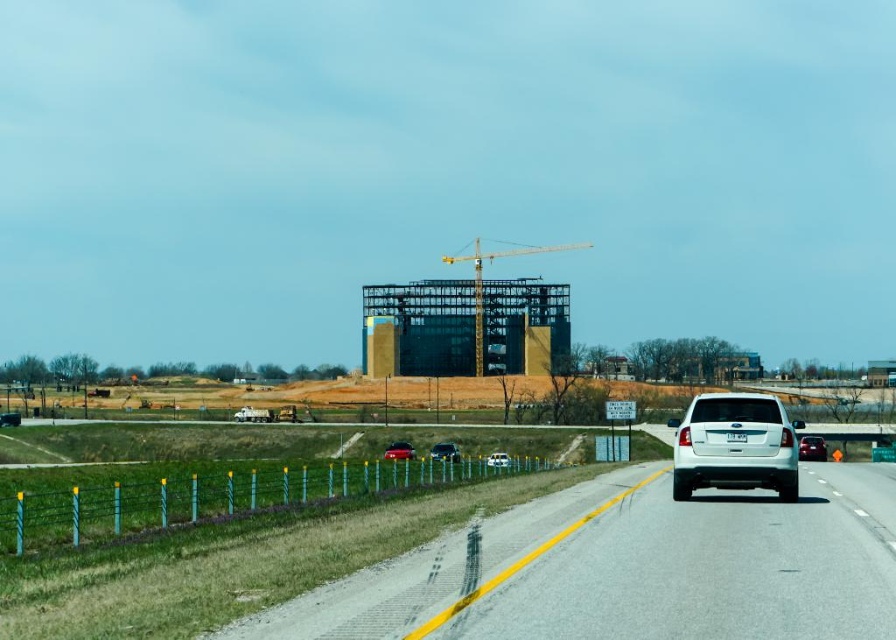
Question: Can you confirm if shiny red car at center is positioned to the right of white matte car at center?

Choices:
 (A) no
 (B) yes

Answer: (A)

Question: Can you confirm if white matte suv at center-right is positioned above shiny black sedan at center?

Choices:
 (A) yes
 (B) no

Answer: (A)

Question: Does shiny silver sedan at center lie behind white matte car at center?

Choices:
 (A) yes
 (B) no

Answer: (B)

Question: Which point appears farthest from the camera in this image?

Choices:
 (A) (478, 292)
 (B) (433, 460)
 (C) (399, 458)

Answer: (A)

Question: Which of the following is the closest to the observer?

Choices:
 (A) shiny black sedan at center
 (B) yellow metal crane at center
 (C) asphalt road at center

Answer: (C)

Question: Which object is farther from the camera taking this photo?

Choices:
 (A) yellow metal crane at center
 (B) asphalt road at center
 (C) white matte car at center
 (D) shiny red car at center

Answer: (A)